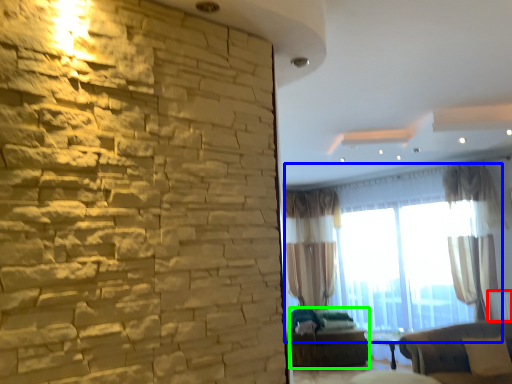
Question: Which is nearer to the radiator (highlighted by a red box)? window (highlighted by a blue box) or futon (highlighted by a green box).

Choices:
 (A) window
 (B) futon

Answer: (A)